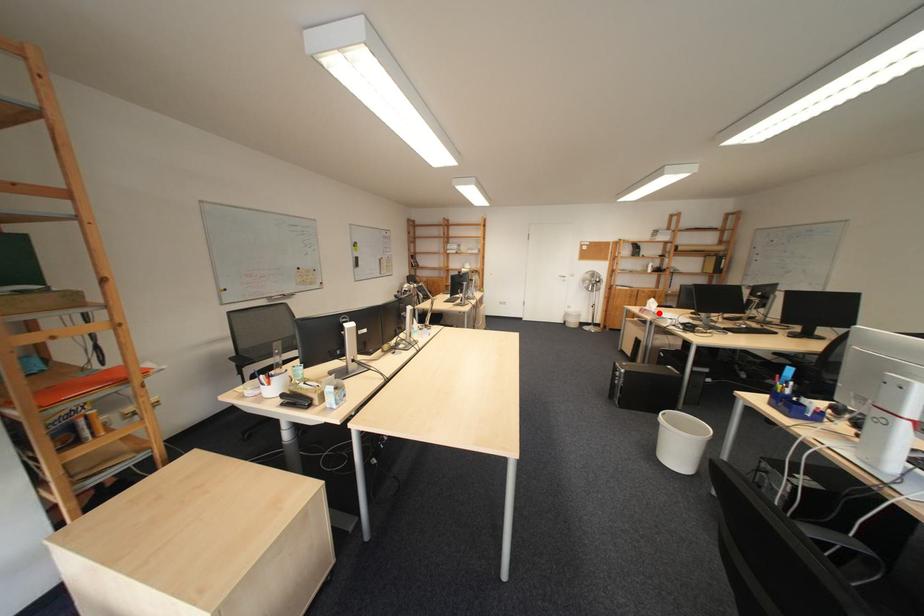
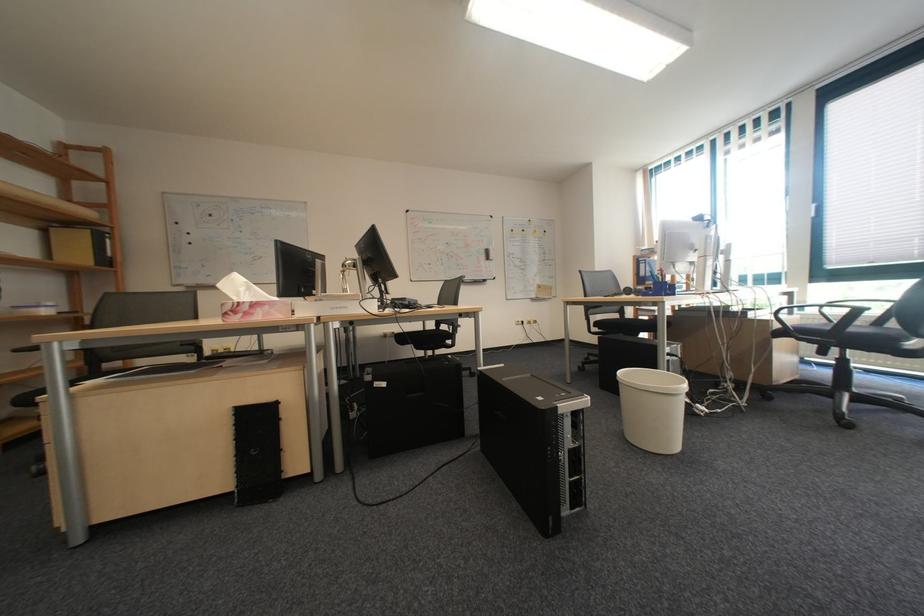
Question: I am providing you with two images of the same scene from different viewpoints. A red point is shown in image1. For the corresponding object point in image2, is it positioned nearer or farther from the camera?

Choices:
 (A) Nearer
 (B) Farther

Answer: (B)